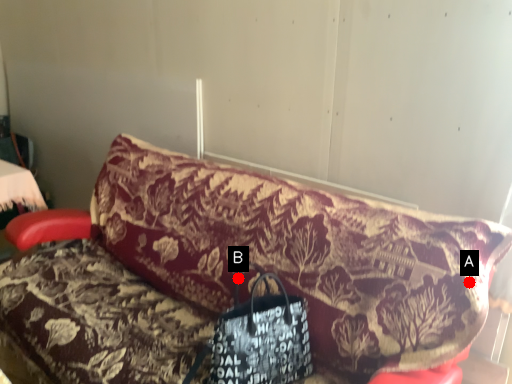
Question: Two points are circled on the image, labeled by A and B beside each circle. Which point is further to the camera?

Choices:
 (A) A is further
 (B) B is further

Answer: (B)